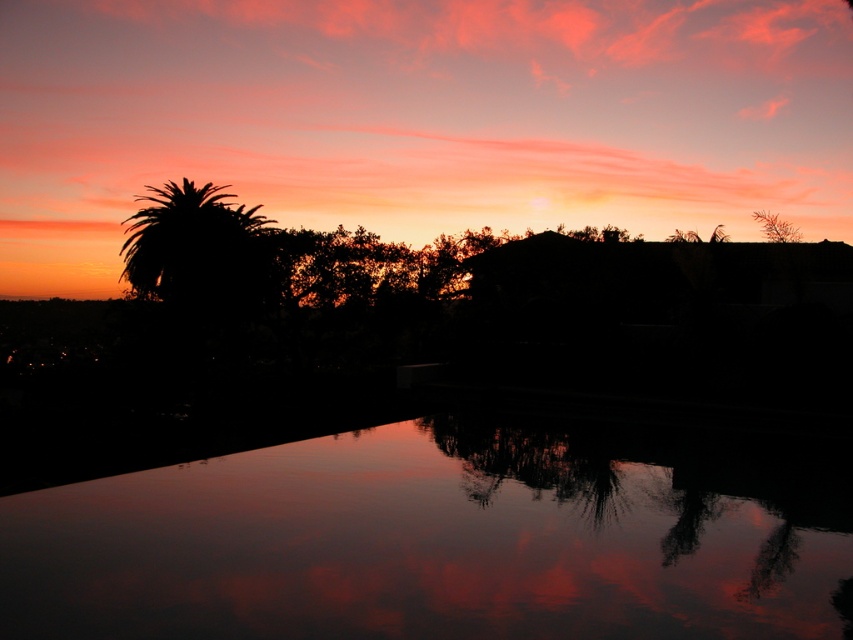
In the scene shown: Who is positioned more to the right, glossy reflective water at center or green leafy tree at upper right?

green leafy tree at upper right

Which is below, glossy reflective water at center or green leafy tree at upper right?

glossy reflective water at center is lower down.

This screenshot has width=853, height=640. Describe the element at coordinates (450, 536) in the screenshot. I see `glossy reflective water at center` at that location.

In order to click on glossy reflective water at center in this screenshot , I will do `click(450, 536)`.

You are a GUI agent. You are given a task and a screenshot of the screen. Output one action in this format:
    pyautogui.click(x=<x>, y=<y>)
    Task: Click on the silhouette palm tree at left
    The width and height of the screenshot is (853, 640).
    Given the screenshot: What is the action you would take?
    pyautogui.click(x=198, y=252)

Is point (225, 214) closer to camera compared to point (796, 230)?

No, (225, 214) is further to viewer.

Find the location of `silhouette palm tree at left`. silhouette palm tree at left is located at coordinates (198, 252).

Which of these two, glossy reflective water at center or silhouette palm tree at left, stands taller?

silhouette palm tree at left

Is glossy reflective water at center bigger than silhouette palm tree at left?

No, glossy reflective water at center is not bigger than silhouette palm tree at left.

Image resolution: width=853 pixels, height=640 pixels. Identify the location of glossy reflective water at center. (450, 536).

This screenshot has width=853, height=640. What are the coordinates of `glossy reflective water at center` in the screenshot? It's located at (450, 536).